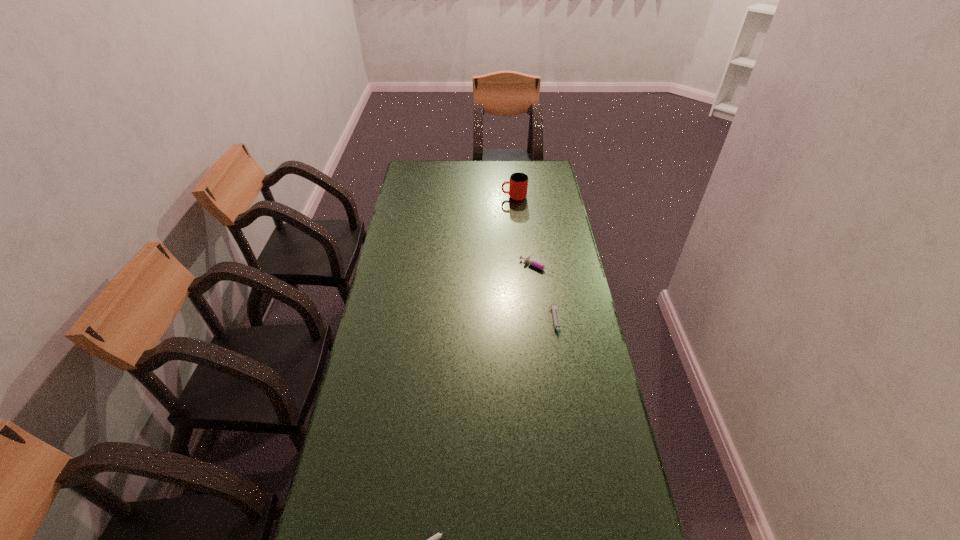
Locate an element on the screen. The height and width of the screenshot is (540, 960). the tallest object is located at coordinates (518, 182).

Image resolution: width=960 pixels, height=540 pixels. Find the location of `cup`. cup is located at coordinates (518, 182).

Find the location of a particular element. the second farthest object is located at coordinates (528, 260).

The width and height of the screenshot is (960, 540). In order to click on the third shortest object in this screenshot , I will do `click(528, 260)`.

The width and height of the screenshot is (960, 540). I want to click on the third tallest object, so click(553, 306).

Locate an element on the screen. the second tallest syringe is located at coordinates (553, 306).

Locate an element on the screen. This screenshot has width=960, height=540. vacant space located 0.180m on the handle side of the cup is located at coordinates (463, 197).

Image resolution: width=960 pixels, height=540 pixels. In order to click on vacant space situated on the handle side of the cup in this screenshot , I will do `click(444, 197)`.

Locate an element on the screen. This screenshot has height=540, width=960. free space located 0.220m on the handle side of the cup is located at coordinates (454, 197).

Where is `free space located 0.180m on the front of the second farthest object`? The width and height of the screenshot is (960, 540). free space located 0.180m on the front of the second farthest object is located at coordinates (544, 313).